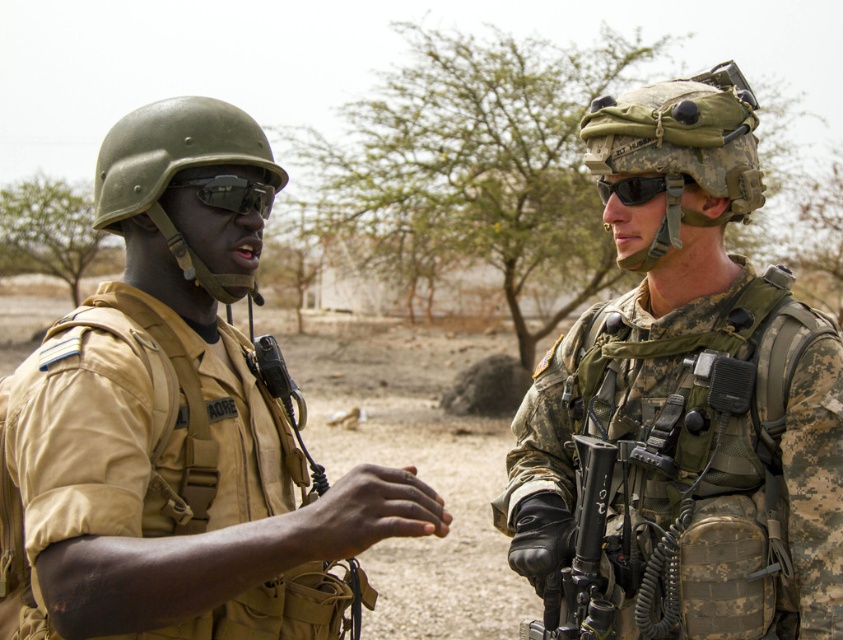
Can you confirm if camouflage fabric helmet at center is shorter than matte black goggles at left?

No.

Which is in front, point (715, 145) or point (242, 184)?

Point (242, 184) is in front.

Where is `camouflage fabric helmet at center`? camouflage fabric helmet at center is located at coordinates (680, 147).

Measure the distance from camo fabric helmet at upper right to matte khaki uniform at center.

camo fabric helmet at upper right and matte khaki uniform at center are 1.06 meters apart from each other.

Who is more forward, (652,157) or (176,145)?

Positioned in front is point (176,145).

Which is in front, point (677, 164) or point (280, 630)?

Positioned in front is point (280, 630).

This screenshot has width=843, height=640. Find the location of `camo fabric helmet at upper right`. camo fabric helmet at upper right is located at coordinates (682, 406).

This screenshot has width=843, height=640. Find the location of `black matte rifle at lower center`. black matte rifle at lower center is located at coordinates (581, 552).

Is the position of black matte rifle at lower center more distant than that of matte black goggles at left?

Yes.

Locate an element on the screen. black matte rifle at lower center is located at coordinates (581, 552).